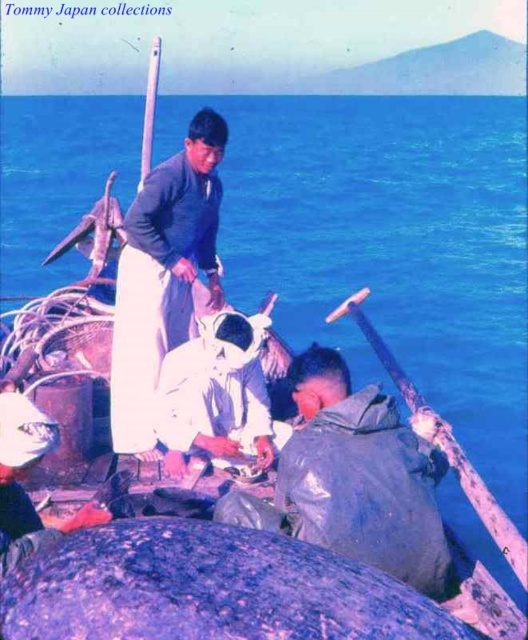
Does point (188, 268) come closer to viewer compared to point (195, 392)?

No.

At what (x,y) coordinates should I click in order to perform the action: click on matte blue shirt at center. Please return your answer as a coordinate pair (x, y). The image size is (528, 640). Looking at the image, I should click on (163, 275).

Where is `matte blue shirt at center`? The width and height of the screenshot is (528, 640). matte blue shirt at center is located at coordinates pyautogui.click(x=163, y=275).

Which of these two, gray matte jacket at lower right or white matte shirt at center, stands shorter?

white matte shirt at center

Does gray matte jacket at lower right have a greater height compared to white matte shirt at center?

Yes, gray matte jacket at lower right is taller than white matte shirt at center.

Measure the distance between point (353, 483) and camera.

Point (353, 483) and camera are 4.03 meters apart from each other.

Locate an element on the screen. This screenshot has height=640, width=528. gray matte jacket at lower right is located at coordinates (x=362, y=476).

Where is `gray matte jacket at lower right`? gray matte jacket at lower right is located at coordinates (362, 476).

Does gray matte jacket at lower right appear on the left side of matte blue shirt at center?

In fact, gray matte jacket at lower right is to the right of matte blue shirt at center.

You are a GUI agent. You are given a task and a screenshot of the screen. Output one action in this format:
    pyautogui.click(x=<x>, y=<y>)
    Task: Click on the gray matte jacket at lower right
    The image size is (528, 640).
    Given the screenshot: What is the action you would take?
    pyautogui.click(x=362, y=476)